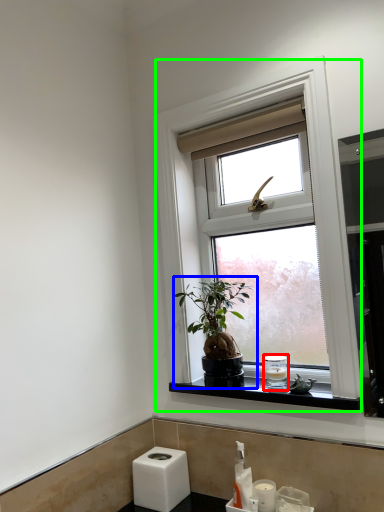
Question: Considering the real-world distances, which object is closest to toiletry (highlighted by a red box)? houseplant (highlighted by a blue box) or window (highlighted by a green box).

Choices:
 (A) houseplant
 (B) window

Answer: (A)